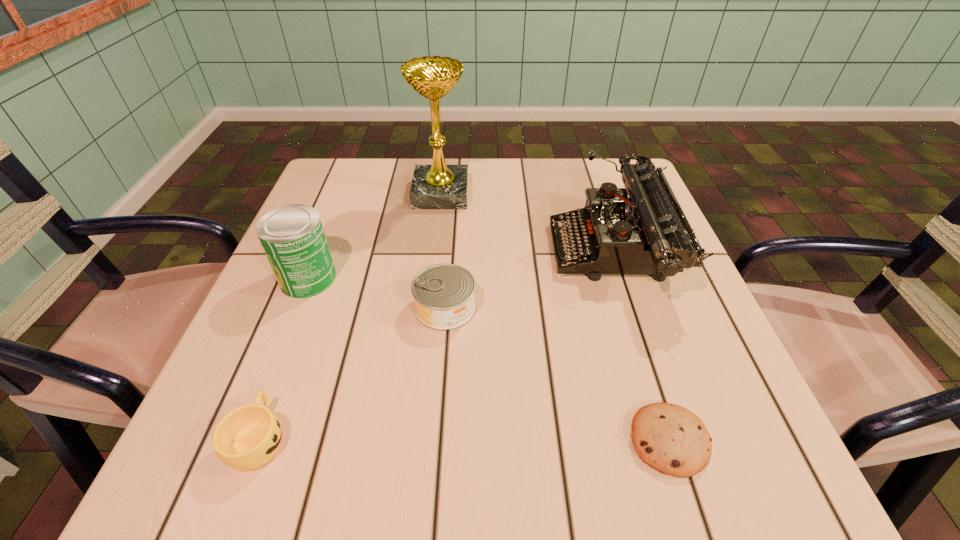
In the image, there is a desktop. Where is `free space at the far left corner`? free space at the far left corner is located at coordinates (x=353, y=183).

Locate an element on the screen. free point between the fourth tallest object and the typewriter is located at coordinates (528, 280).

Find the location of `empty space that is in between the taller can and the typewriter`. empty space that is in between the taller can and the typewriter is located at coordinates (460, 265).

At what (x,y) coordinates should I click in order to perform the action: click on free space between the cup and the left can. Please return your answer as a coordinate pair (x, y). Image resolution: width=960 pixels, height=540 pixels. Looking at the image, I should click on (283, 358).

This screenshot has width=960, height=540. Identify the location of vacant space in between the tallest object and the cookie. (555, 317).

Find the location of a particular element. The image size is (960, 540). free space between the tallest object and the cookie is located at coordinates (555, 317).

The image size is (960, 540). Find the location of `free space between the second shortest object and the typewriter`. free space between the second shortest object and the typewriter is located at coordinates (435, 345).

Where is `free space between the cup and the tallest object`? free space between the cup and the tallest object is located at coordinates (350, 316).

Find the location of `free space between the fourth tallest object and the cookie`. free space between the fourth tallest object and the cookie is located at coordinates (557, 374).

Identify the location of free space between the cookie and the award. Image resolution: width=960 pixels, height=540 pixels. coord(555,317).